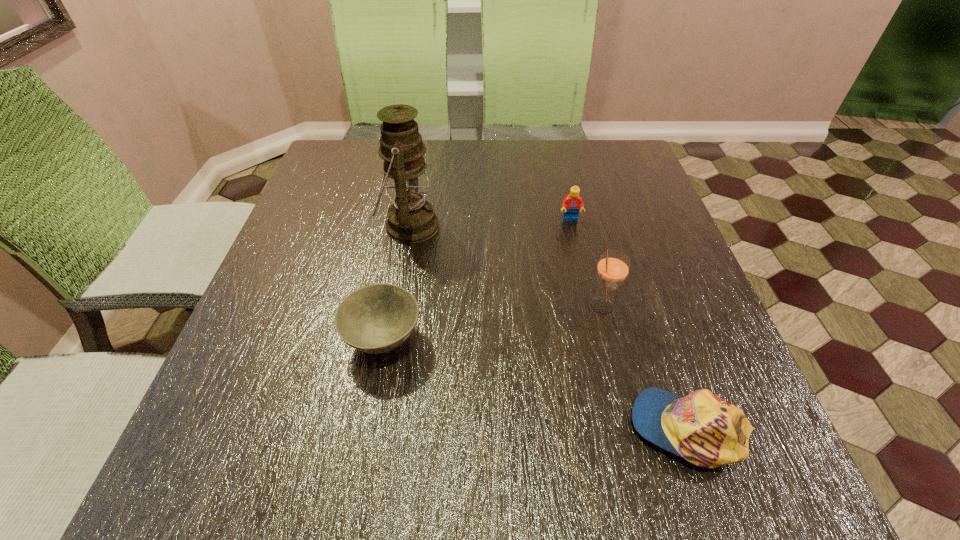
You are a GUI agent. You are given a task and a screenshot of the screen. Output one action in this format:
    pyautogui.click(x=<x>, y=<y>)
    Task: Click on the blank space located on the bill of the nearest object
    The image size is (960, 540).
    Given the screenshot: What is the action you would take?
    pyautogui.click(x=481, y=428)

Where is `vacant space situated 0.060m on the bill of the nearest object`? vacant space situated 0.060m on the bill of the nearest object is located at coordinates (593, 428).

I want to click on object present at the near edge, so click(704, 429).

The height and width of the screenshot is (540, 960). In order to click on object that is at the right edge in this screenshot , I will do `click(704, 429)`.

At what (x,y) coordinates should I click in order to perform the action: click on object at the near right corner. Please return your answer as a coordinate pair (x, y). This screenshot has height=540, width=960. Looking at the image, I should click on (704, 429).

You are a GUI agent. You are given a task and a screenshot of the screen. Output one action in this format:
    pyautogui.click(x=<x>, y=<y>)
    Task: Click on the vacant space at the far edge of the desktop
    This screenshot has width=960, height=540.
    Given the screenshot: What is the action you would take?
    pyautogui.click(x=429, y=151)

In the image, there is a desktop. Where is `free space at the near edge`? This screenshot has width=960, height=540. free space at the near edge is located at coordinates (389, 489).

This screenshot has width=960, height=540. What are the coordinates of `free space at the left edge of the desktop` in the screenshot? It's located at (351, 205).

Identify the location of vacant space at the right edge of the desktop. (674, 307).

The width and height of the screenshot is (960, 540). In the image, there is a desktop. Identify the location of vacant space at the far right corner. (622, 155).